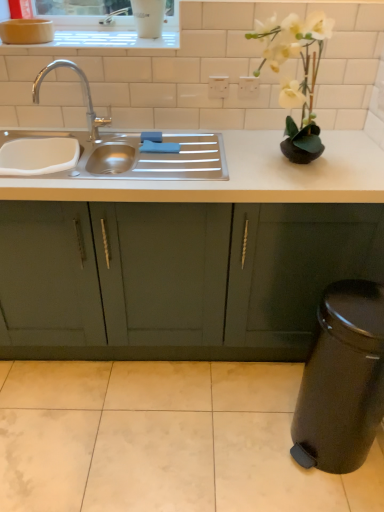
I want to click on vacant area situated below white matte vase at upper right (from a real-world perspective), so click(293, 164).